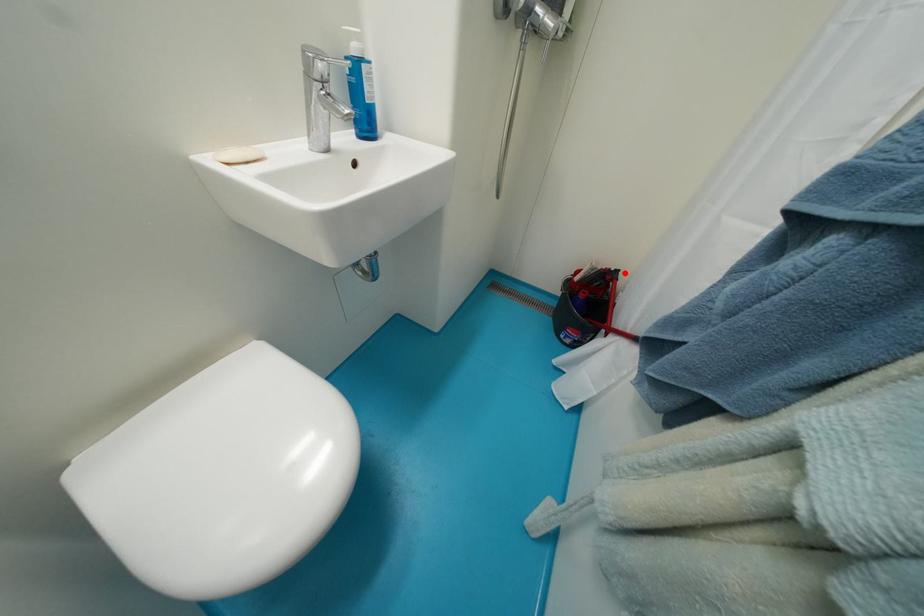
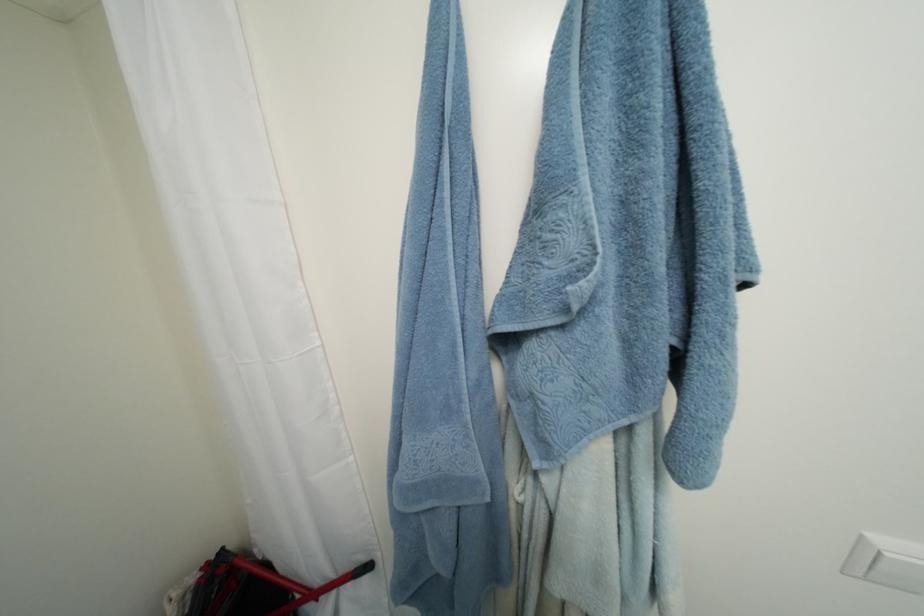
Locate, in the second image, the point that corresponds to the highlighted location in the first image.

(229, 552)